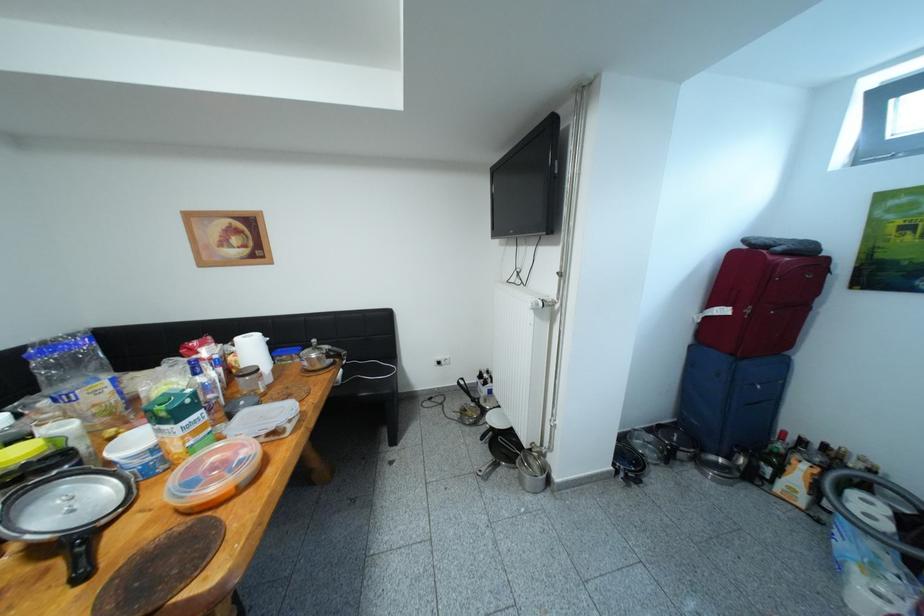
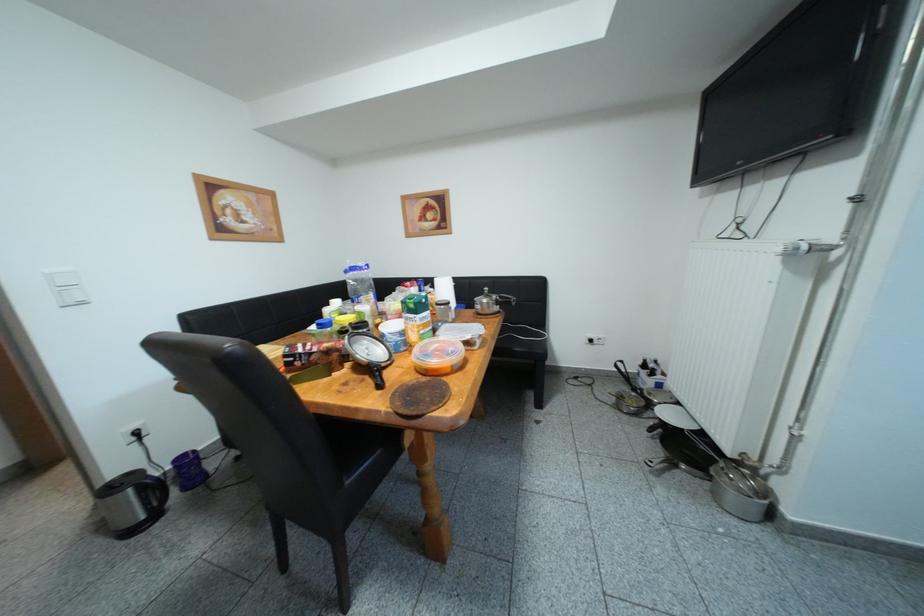
Question: What movement of the cameraman would produce the second image?

Choices:
 (A) Left
 (B) Right
 (C) Forward
 (D) Backward

Answer: (A)